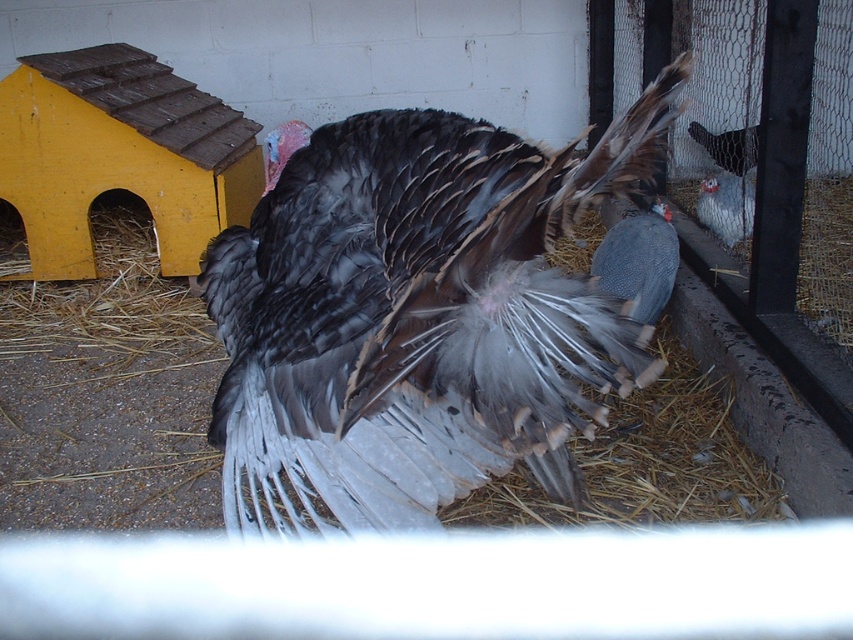
You are standing at the entrance of the poultry enclosure and see two points marked in the image. The first point is at coordinates point (323, 428) and the second point is at point (733, 241). Which point is closer to you?

Point (323, 428) is in front of point (733, 241), so it is closer to you.

You are a farmer checking the poultry enclosure. You notice the gray speckled feathered bird at right and the gray matte turkey at center. Which bird would cast a bigger shadow if the sun is directly overhead?

The gray speckled feathered bird at right has a larger size compared to the gray matte turkey at center, so it would cast a bigger shadow.